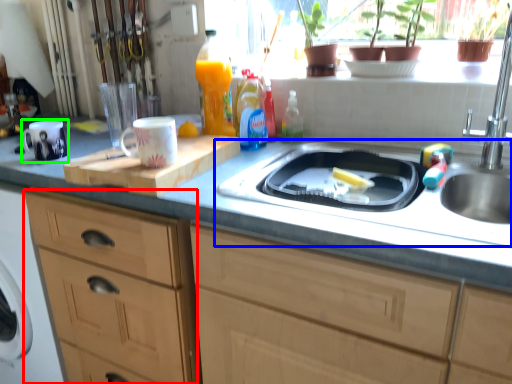
Question: Based on their relative distances, which object is farther from cabinetry (highlighted by a red box)? Choose from sink (highlighted by a blue box) and mug (highlighted by a green box).

Choices:
 (A) sink
 (B) mug

Answer: (A)